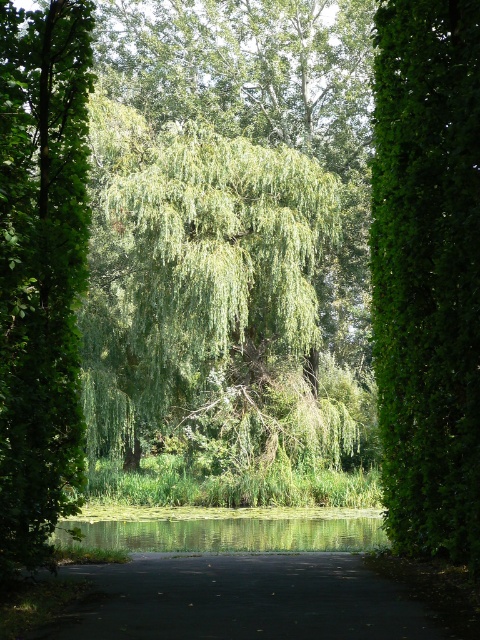
You are standing at the edge of the green reflective water at center and want to reach the green leafy willow at center. Which direction should you walk to get closer to the willow?

The green leafy willow at center is wider than the green reflective water at center, so you should walk towards the center of the image where the willow is located to get closer.

You are a gardener planning to trim the green leafy hedge at right and the green leafy tree at left. Which of the two requires a taller ladder to reach its branches?

The green leafy tree at left requires a taller ladder because it is thicker than the green leafy hedge at right.